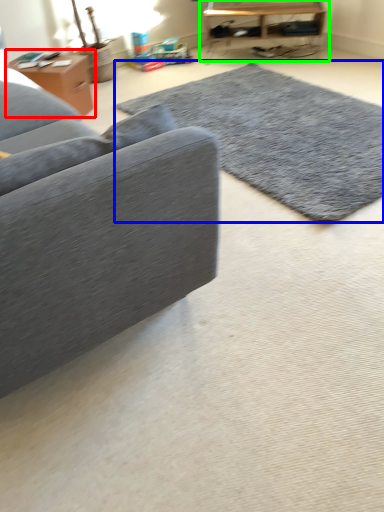
Question: Which object is the closest to the table (highlighted by a red box)? Choose among these: mat (highlighted by a blue box) or table (highlighted by a green box).

Choices:
 (A) mat
 (B) table

Answer: (A)